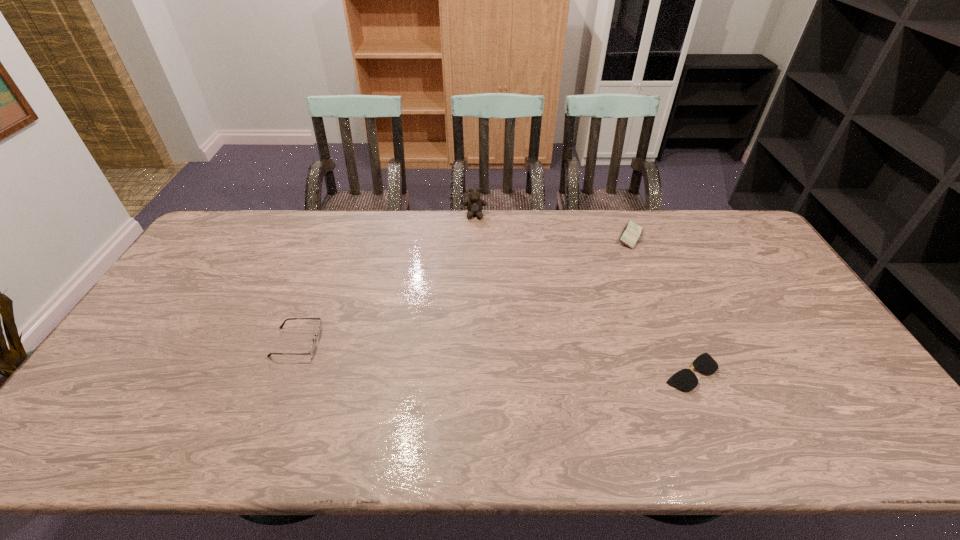
Where is `vacant region located 0.270m on the front-facing side of the second shortest object`? The image size is (960, 540). vacant region located 0.270m on the front-facing side of the second shortest object is located at coordinates (418, 342).

Identify the location of free region located on the right of the right spectacles. (851, 372).

Where is `teddy bear positioned at the far edge`? The image size is (960, 540). teddy bear positioned at the far edge is located at coordinates (474, 204).

Identify the location of diary situated at the far edge. [631, 233].

Where is `vacant space at the far edge of the desktop`? The width and height of the screenshot is (960, 540). vacant space at the far edge of the desktop is located at coordinates (405, 234).

Where is `free region at the near edge of the desktop`? The width and height of the screenshot is (960, 540). free region at the near edge of the desktop is located at coordinates (250, 426).

You are a GUI agent. You are given a task and a screenshot of the screen. Output one action in this format:
    pyautogui.click(x=<x>, y=<y>)
    Task: Click on the vacant space at the left edge
    
    Given the screenshot: What is the action you would take?
    pyautogui.click(x=110, y=371)

What are the coordinates of `free location at the right edge` in the screenshot? It's located at (818, 392).

The width and height of the screenshot is (960, 540). Find the location of `free point at the far right corner`. free point at the far right corner is located at coordinates (735, 235).

Identify the location of empty space that is in between the tallest object and the taller spectacles. Image resolution: width=960 pixels, height=540 pixels. (386, 279).